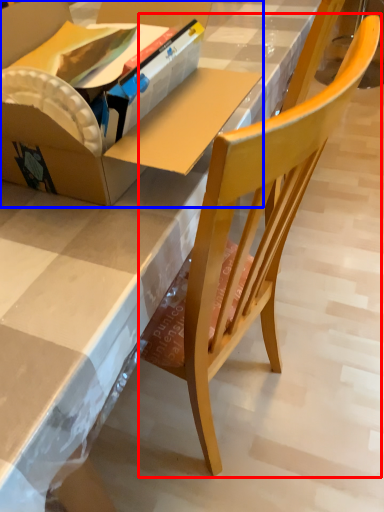
Question: Among these objects, which one is farthest to the camera, chair (highlighted by a red box) or box (highlighted by a blue box)?

Choices:
 (A) chair
 (B) box

Answer: (B)